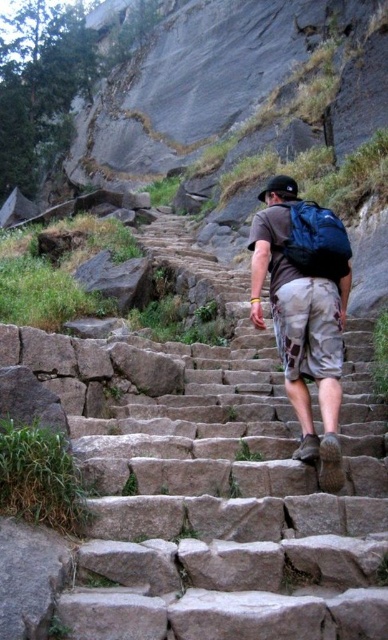
Question: Is camouflage shorts at center to the right of matte blue backpack at upper center from the viewer's perspective?

Choices:
 (A) no
 (B) yes

Answer: (A)

Question: Estimate the real-world distances between objects in this image. Which object is farther from the gray stone stairs at center?

Choices:
 (A) camouflage shorts at center
 (B) matte blue backpack at upper center

Answer: (B)

Question: Based on their relative distances, which object is nearer to the matte blue backpack at upper center?

Choices:
 (A) gray stone stairs at center
 (B) camouflage shorts at center

Answer: (B)

Question: Is camouflage shorts at center below matte blue backpack at upper center?

Choices:
 (A) no
 (B) yes

Answer: (A)

Question: Is camouflage shorts at center positioned in front of matte blue backpack at upper center?

Choices:
 (A) yes
 (B) no

Answer: (A)

Question: Based on their relative distances, which object is farther from the camouflage shorts at center?

Choices:
 (A) matte blue backpack at upper center
 (B) gray stone stairs at center

Answer: (B)